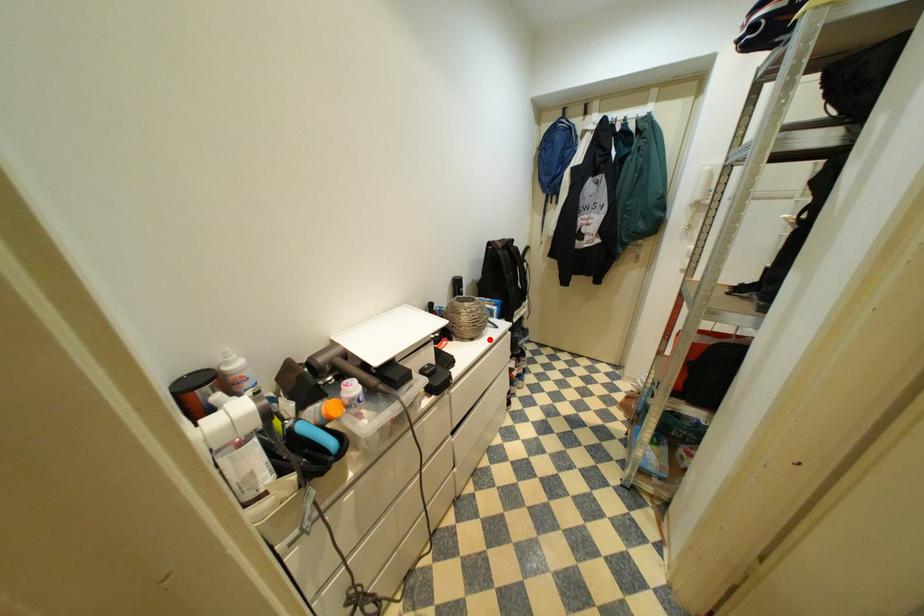
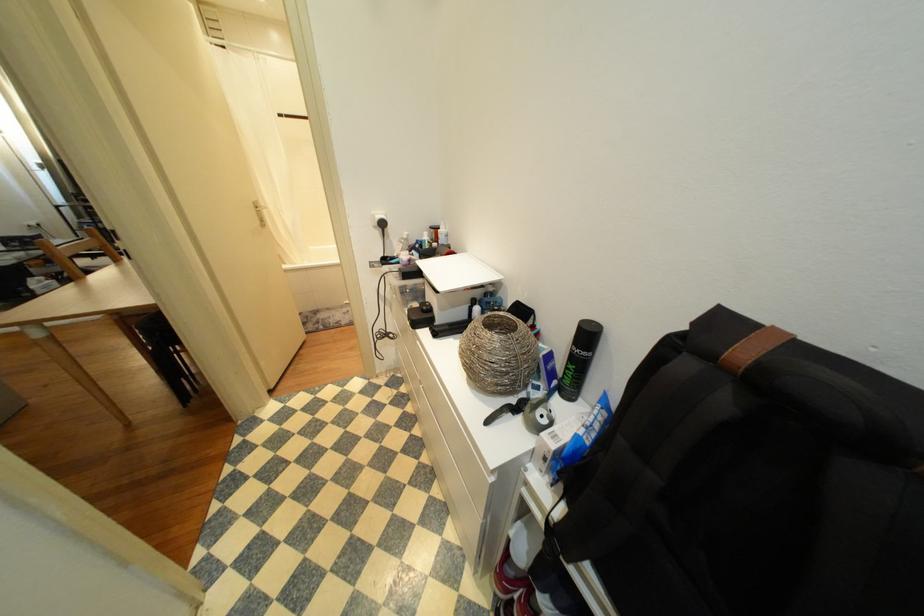
Locate, in the second image, the point that corresponds to the highlighted location in the first image.

(476, 384)